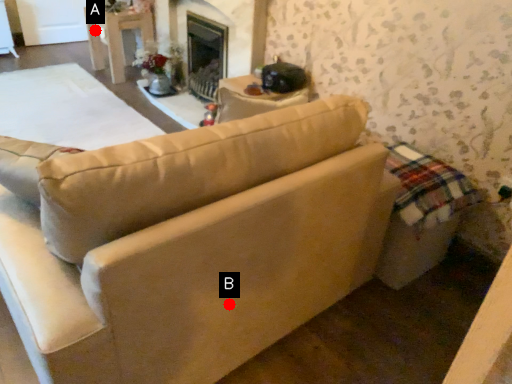
Question: Two points are circled on the image, labeled by A and B beside each circle. Among these points, which one is farthest from the camera?

Choices:
 (A) A is further
 (B) B is further

Answer: (A)